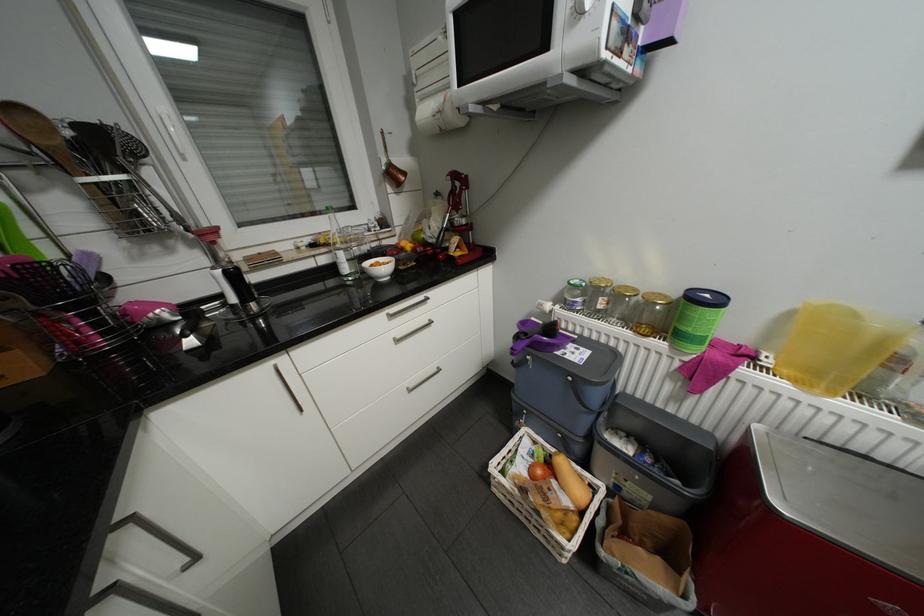
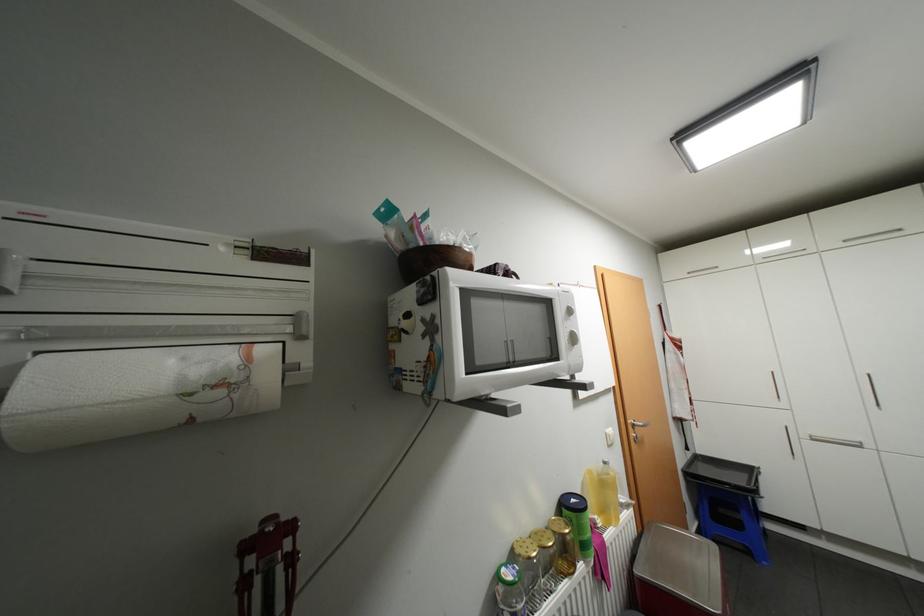
Question: I am providing you with two images of the same scene from different viewpoints. After the viewpoint changes to image2, which objects are now occluded?

Choices:
 (A) silver cabinet handle
 (B) white microwave dial
 (C) glass jar with lid
 (D) none of these

Answer: (D)